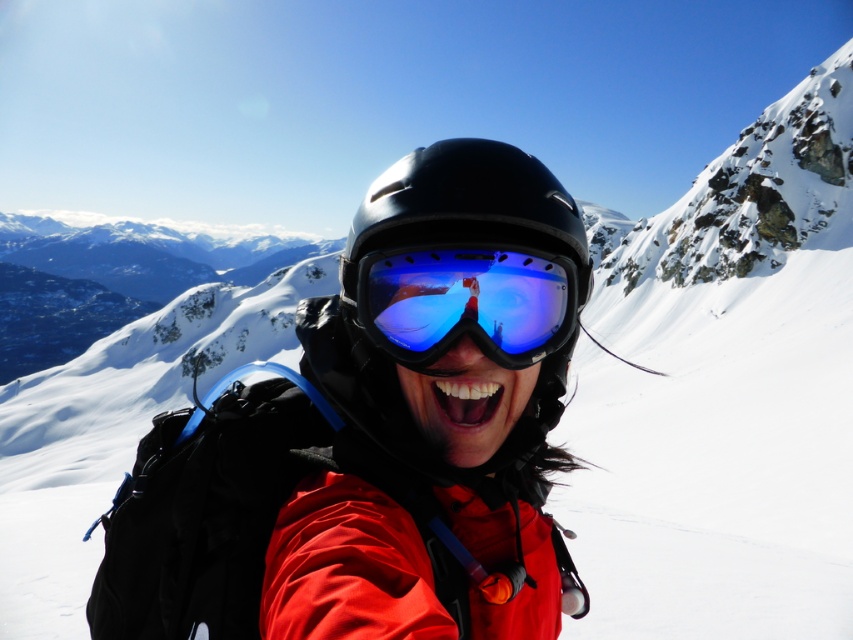
You are a photographer trying to capture the perfect shot of the blue reflective lens at center and the black matte helmet at center. If you want to ensure both objects are in focus, which one should you adjust your camera focus on first, considering their sizes?

The blue reflective lens at center has a smaller width than the black matte helmet at center, so you should focus on the black matte helmet at center first as it is larger and likely the main subject.

From the picture: You are a photographer trying to capture the winter sports equipment. You notice the blue reflective lens at center and the black matte helmet at center. Which object should you focus on if you want to photograph the smaller one?

The blue reflective lens at center occupies less space than the black matte helmet at center, so you should focus on the blue reflective lens at center to photograph the smaller one.